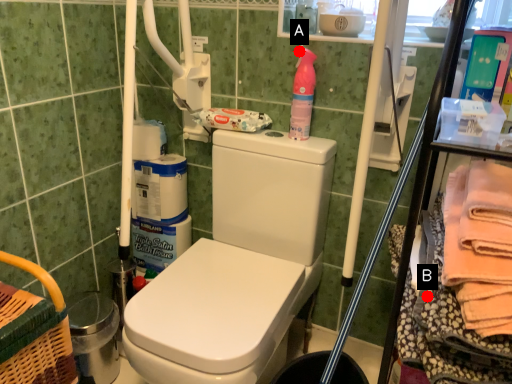
Question: Two points are circled on the image, labeled by A and B beside each circle. Which point is closer to the camera?

Choices:
 (A) A is closer
 (B) B is closer

Answer: (B)